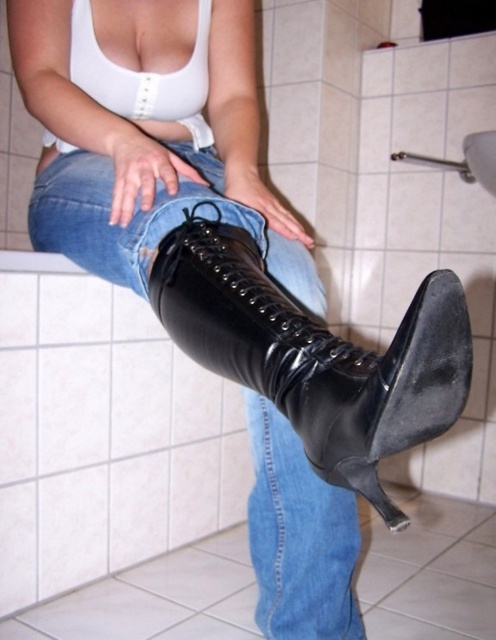
You are a fashion stylist trying to take a photo of a model wearing the black patent leather boot at center and jeans at center. The client wants the boot and jeans to be closer together in the photo. Can you adjust the model or camera position to achieve this without moving the model?

The black patent leather boot at center and jeans at center are currently 8.44 inches apart. To make them appear closer in the photo without moving the model, you can zoom in with the camera or move the camera closer to the model to reduce the perceived distance between them.

You are designing a floor plan for a bathroom and need to place a rug. The black patent leather boot at center is located at coordinate point 0.555, 0.637. If the rug must be placed such that it covers the boot, what are the minimum coordinates needed to ensure the rug covers the boot?

The minimum coordinates needed to ensure the rug covers the black patent leather boot at center would be from point (x=315, y=355) to the same point, but since the boot has a physical size, the rug must extend slightly beyond this coordinate to fully cover it. However, without knowing the boot size, the exact coordinates can only be determined based on the boot position at (x=315, y=355).

You are trying to find your jeans in a cluttered bathroom. You see the black patent leather boot at center and the jeans at center. According to the image, which object is positioned to the right of the other?

The black patent leather boot at center is to the right of jeans at center.